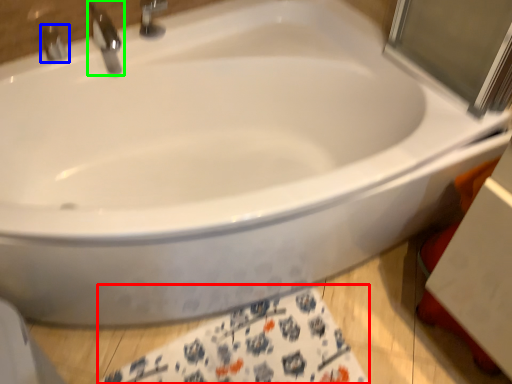
Question: Considering the real-world distances, which object is closest to bath towel (highlighted by a red box)? tap (highlighted by a blue box) or tap (highlighted by a green box).

Choices:
 (A) tap
 (B) tap

Answer: (B)